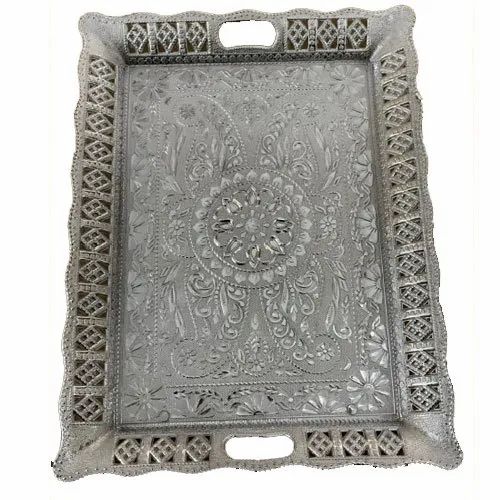
Where is `rectangle shaped tray`? rectangle shaped tray is located at coordinates (311, 120).